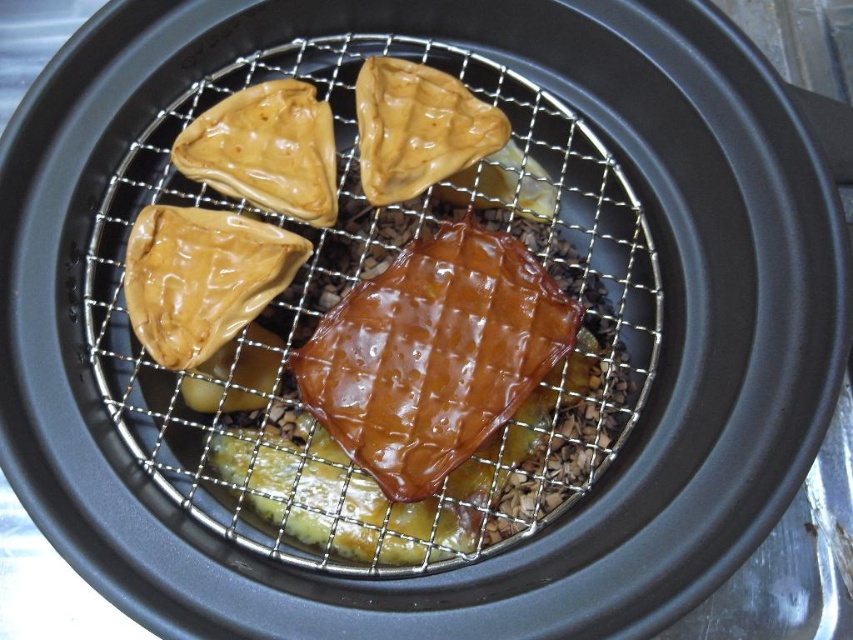
How distant is shiny brown waffle at center from glossy brown pastry at center?

They are 17.22 centimeters apart.

Can you confirm if shiny brown waffle at center is taller than glossy brown pastry at center?

Yes.

Does point (158, 280) come farther from viewer compared to point (265, 289)?

No.

You are a GUI agent. You are given a task and a screenshot of the screen. Output one action in this format:
    pyautogui.click(x=<x>, y=<y>)
    Task: Click on the shiny brown waffle at center
    The width and height of the screenshot is (853, 640).
    Given the screenshot: What is the action you would take?
    pyautogui.click(x=374, y=320)

Who is positioned more to the left, shiny brown waffle at center or glossy brown pastry at upper left?

glossy brown pastry at upper left

Does shiny brown waffle at center appear under glossy brown pastry at upper left?

Correct, shiny brown waffle at center is located below glossy brown pastry at upper left.

I want to click on shiny brown waffle at center, so click(374, 320).

Which is in front, point (349, 417) or point (380, 186)?

Point (349, 417)

Is shiny brown meat at center to the right of shiny brown pastry at upper center from the viewer's perspective?

Yes, shiny brown meat at center is to the right of shiny brown pastry at upper center.

Is point (405, 330) more distant than point (374, 172)?

No, it is in front of (374, 172).

You are a GUI agent. You are given a task and a screenshot of the screen. Output one action in this format:
    pyautogui.click(x=<x>, y=<y>)
    Task: Click on the shiny brown meat at center
    The width and height of the screenshot is (853, 640).
    Given the screenshot: What is the action you would take?
    tap(433, 355)